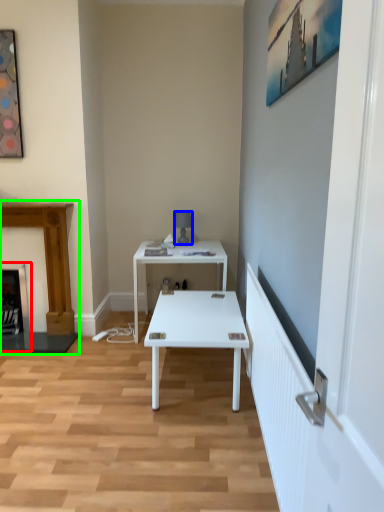
Question: Which is farther away from fireplace (highlighted by a red box)? lamp (highlighted by a blue box) or fireplace (highlighted by a green box)?

Choices:
 (A) lamp
 (B) fireplace

Answer: (A)